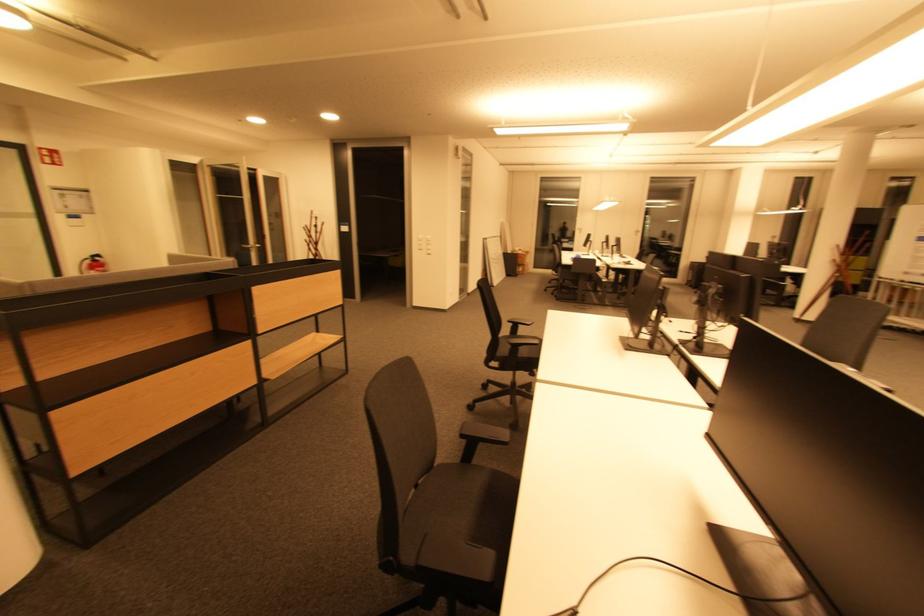
Identify the location of fire extinguisher handle. (82, 265).